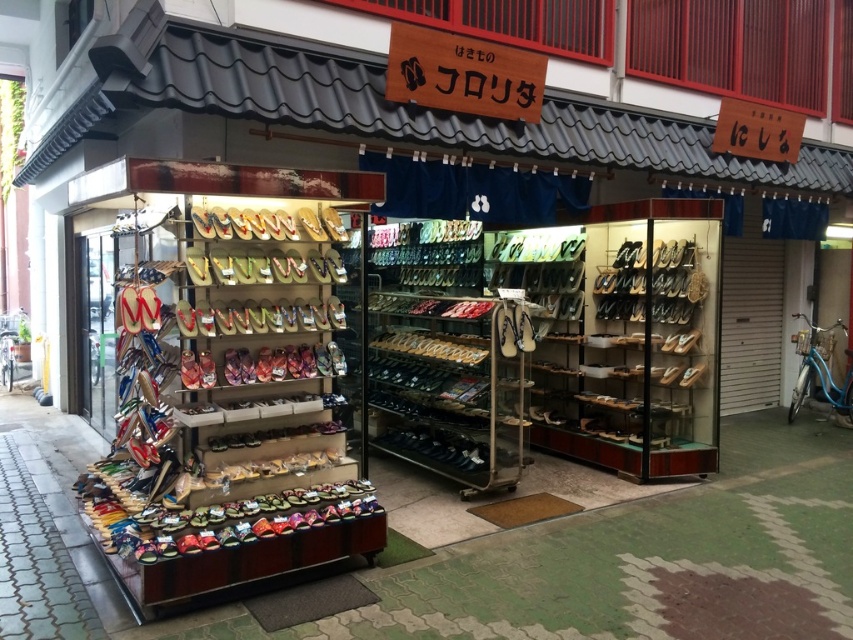
Is matte wooden sandals at center to the left of shiny metallic sandals at center from the viewer's perspective?

In fact, matte wooden sandals at center is to the right of shiny metallic sandals at center.

Is matte wooden sandals at center behind shiny metallic sandals at center?

No, matte wooden sandals at center is in front of shiny metallic sandals at center.

Locate an element on the screen. The image size is (853, 640). matte wooden sandals at center is located at coordinates (267, 224).